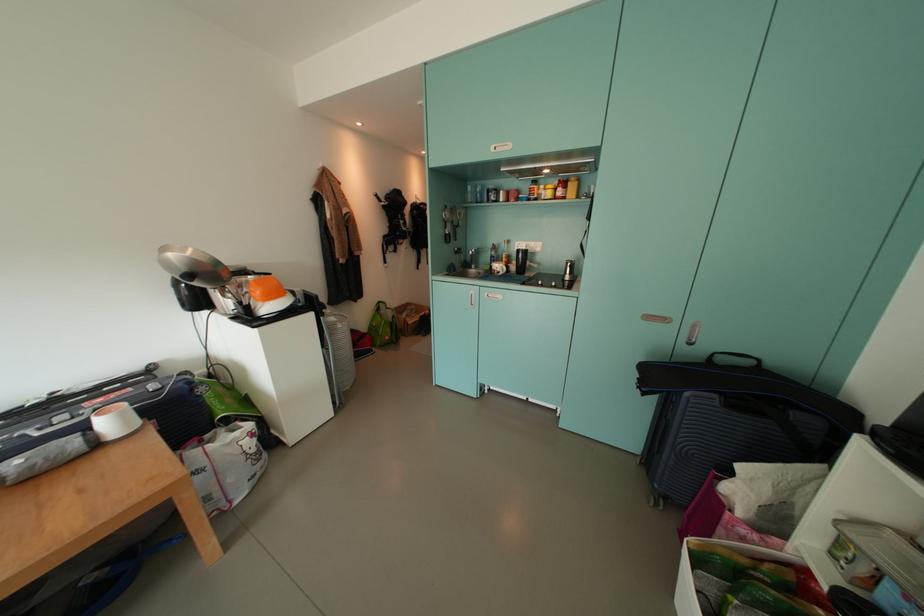
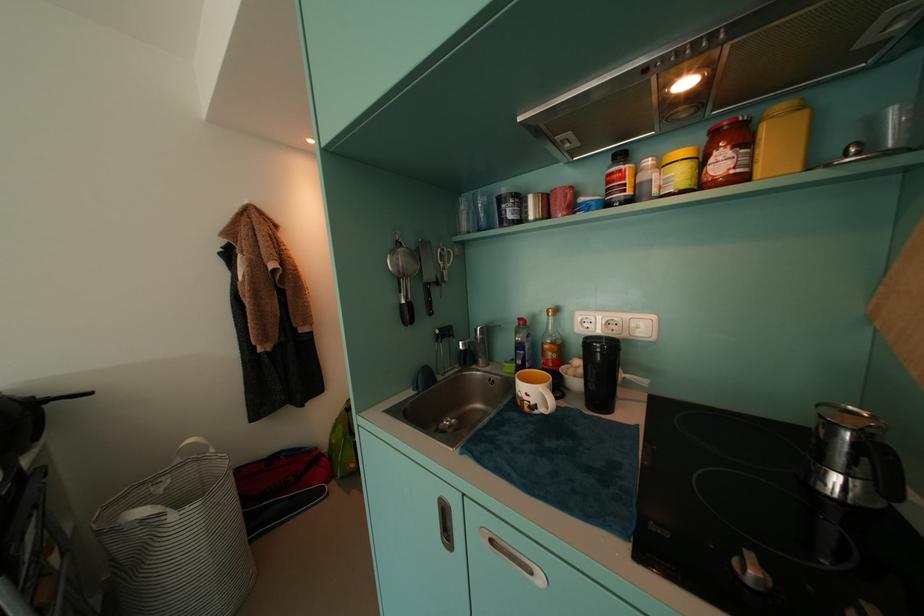
The point at (480, 270) is marked in the first image. Where is the corresponding point in the second image?

(488, 363)